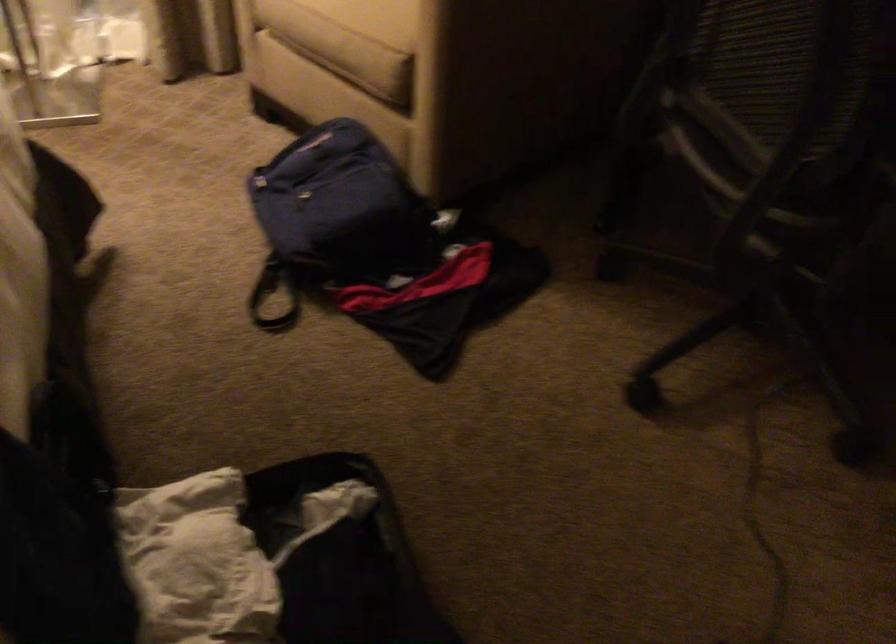
Where would you lift the backpack strap? Please return your answer as a coordinate pair (x, y).

(263, 297)